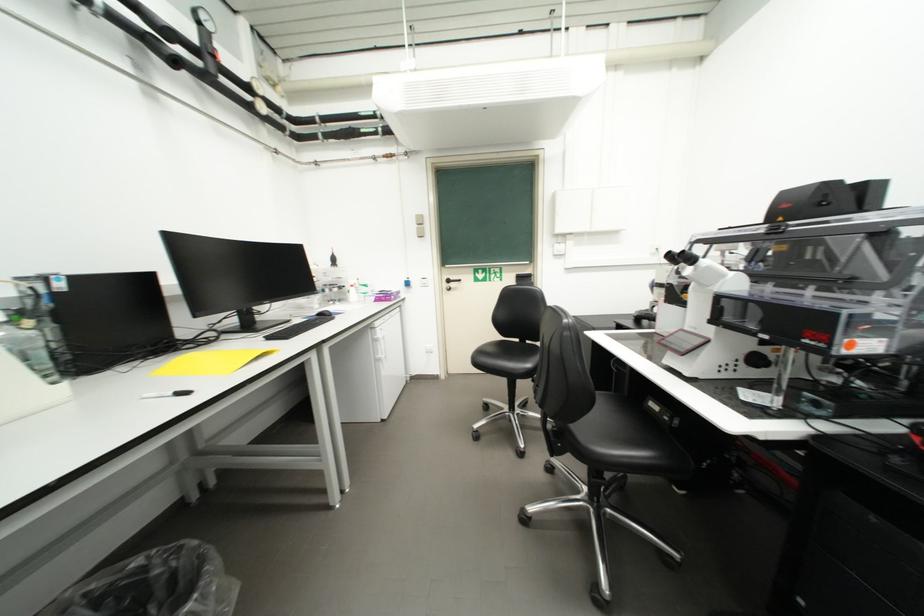
Locate an element on the screen. microscope focus knob is located at coordinates (687, 257).